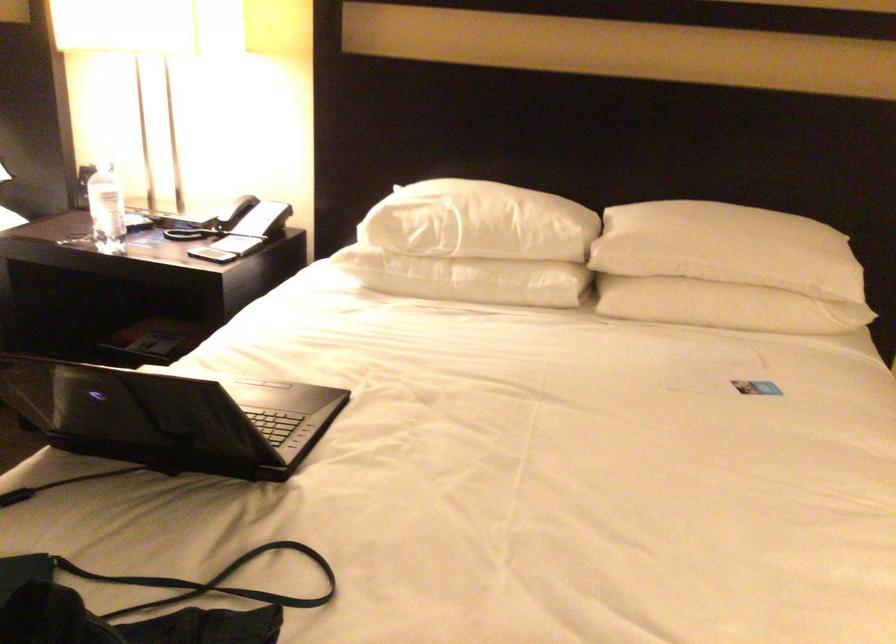
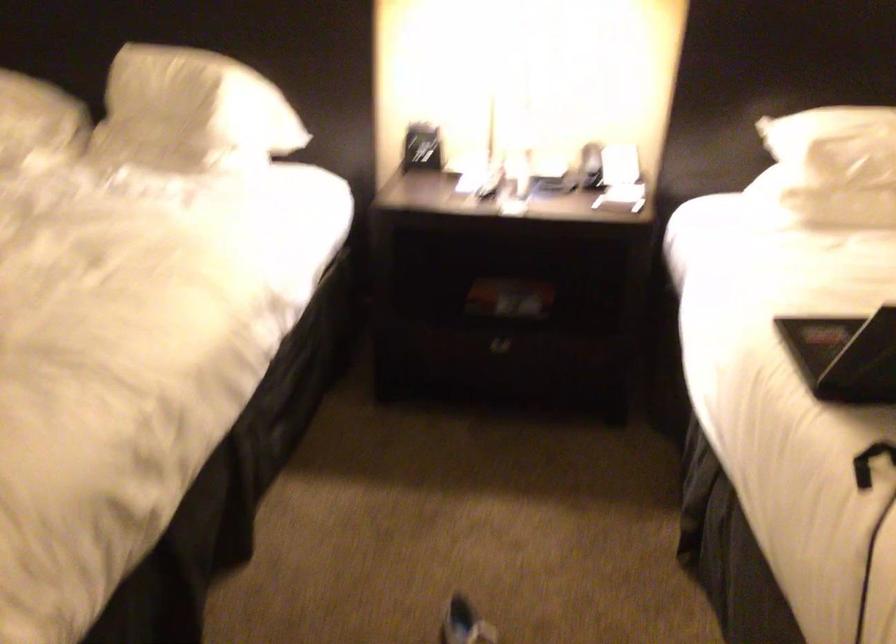
Question: Which direction would the cameraman need to move to produce the second image? Reply with the corresponding letter.

Choices:
 (A) Left
 (B) Right
 (C) Forward
 (D) Backward

Answer: (A)